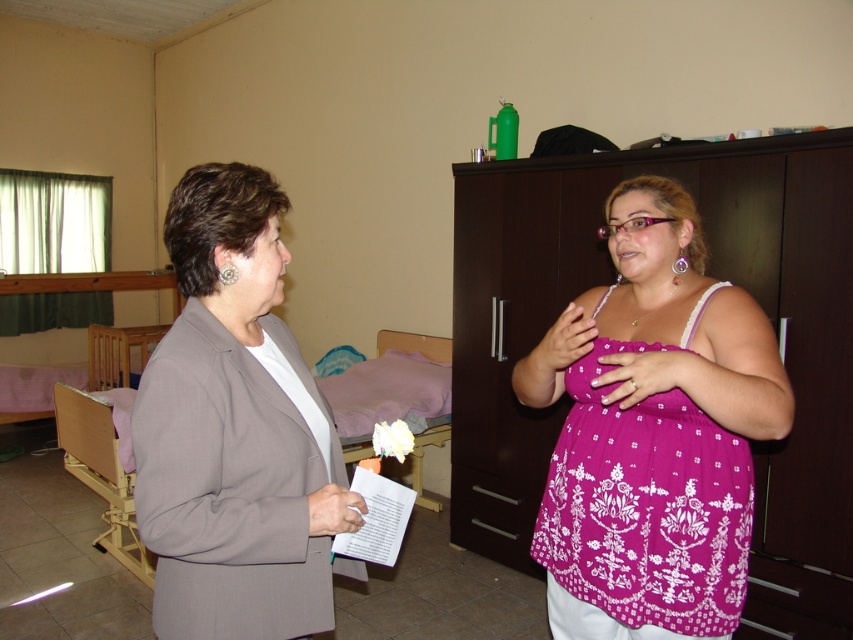
Question: Is purple printed blouse at center bigger than matte gray blazer at center?

Choices:
 (A) yes
 (B) no

Answer: (A)

Question: Does purple printed blouse at center lie behind matte gray blazer at center?

Choices:
 (A) no
 (B) yes

Answer: (B)

Question: Which object is farther from the camera taking this photo?

Choices:
 (A) matte gray blazer at center
 (B) purple printed blouse at center

Answer: (B)

Question: Is purple printed blouse at center positioned before matte gray blazer at center?

Choices:
 (A) no
 (B) yes

Answer: (A)

Question: Which point is closer to the camera?

Choices:
 (A) matte gray blazer at center
 (B) purple printed blouse at center

Answer: (A)